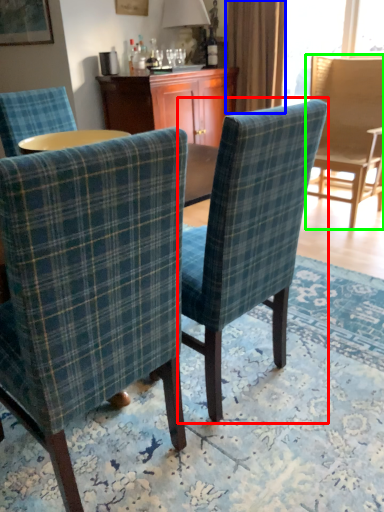
Question: Based on their relative distances, which object is nearer to chair (highlighted by a red box)? Choose from curtain (highlighted by a blue box) and chair (highlighted by a green box).

Choices:
 (A) curtain
 (B) chair

Answer: (B)